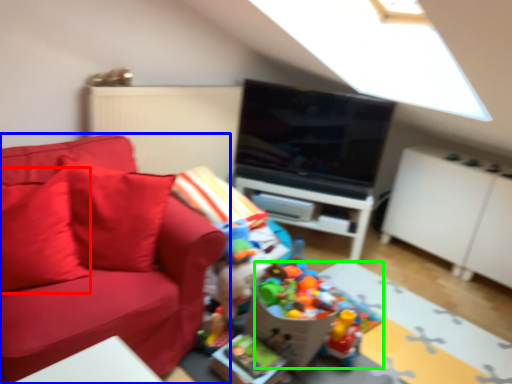
Question: Which object is positioned farthest from pillow (highlighted by a red box)? Select from studio couch (highlighted by a blue box) and toy (highlighted by a green box).

Choices:
 (A) studio couch
 (B) toy

Answer: (B)